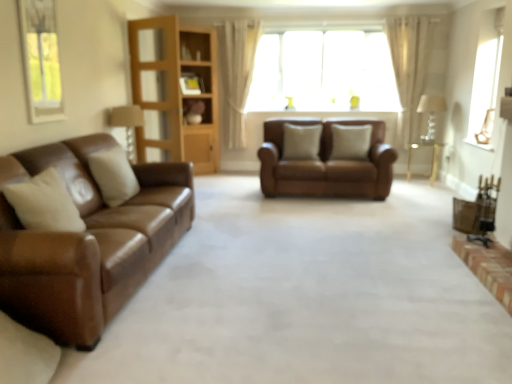
Question: Considering the relative sizes of metallic gold chair at lower right and white sheer curtain at upper center, arranged as the 2th curtain when viewed from the right, in the image provided, is metallic gold chair at lower right shorter than white sheer curtain at upper center, arranged as the 2th curtain when viewed from the right,?

Choices:
 (A) yes
 (B) no

Answer: (A)

Question: From a real-world perspective, is metallic gold chair at lower right located beneath white sheer curtain at upper center, arranged as the 2th curtain when viewed from the right?

Choices:
 (A) no
 (B) yes

Answer: (B)

Question: Does metallic gold chair at lower right turn towards white sheer curtain at upper center, arranged as the 2th curtain when viewed from the right?

Choices:
 (A) yes
 (B) no

Answer: (B)

Question: Considering the relative positions of metallic gold chair at lower right and white sheer curtain at upper center, the 1th curtain viewed from the left, in the image provided, is metallic gold chair at lower right to the left of white sheer curtain at upper center, the 1th curtain viewed from the left, from the viewer's perspective?

Choices:
 (A) no
 (B) yes

Answer: (A)

Question: From the image's perspective, is metallic gold chair at lower right beneath white sheer curtain at upper center, the 1th curtain viewed from the left?

Choices:
 (A) yes
 (B) no

Answer: (A)

Question: From the image's perspective, relative to beige leather pillow at left, placed as the third pillow when sorted from right to left, is wooden bookshelf at center above or below?

Choices:
 (A) below
 (B) above

Answer: (B)

Question: Would you say wooden bookshelf at center is to the left or to the right of beige leather pillow at left, the first pillow from the left, in the picture?

Choices:
 (A) left
 (B) right

Answer: (A)

Question: From a real-world perspective, is wooden bookshelf at center above or below beige leather pillow at left, placed as the third pillow when sorted from right to left?

Choices:
 (A) above
 (B) below

Answer: (A)

Question: In terms of size, does wooden bookshelf at center appear bigger or smaller than beige leather pillow at left, the first pillow from the left?

Choices:
 (A) small
 (B) big

Answer: (B)

Question: Does point (472, 129) appear closer or farther from the camera than point (489, 218)?

Choices:
 (A) closer
 (B) farther

Answer: (B)

Question: Based on their positions, is clear glass window at upper right, placed as the second window when sorted from left to right, located to the left or right of metallic gold chair at lower right?

Choices:
 (A) left
 (B) right

Answer: (B)

Question: Considering the positions of clear glass window at upper right, placed as the second window when sorted from left to right, and metallic gold chair at lower right in the image, is clear glass window at upper right, placed as the second window when sorted from left to right, taller or shorter than metallic gold chair at lower right?

Choices:
 (A) short
 (B) tall

Answer: (B)

Question: From the image's perspective, is clear glass window at upper right, which is counted as the 2th window, starting from the back, located above or below metallic gold chair at lower right?

Choices:
 (A) below
 (B) above

Answer: (B)

Question: In the image, is metallic gold chair at lower right on the left side or the right side of beige fabric pillow at center, the 3th pillow viewed from the left?

Choices:
 (A) right
 (B) left

Answer: (A)

Question: Is metallic gold chair at lower right inside the boundaries of beige fabric pillow at center, the 2th pillow viewed from the front, or outside?

Choices:
 (A) inside
 (B) outside

Answer: (B)